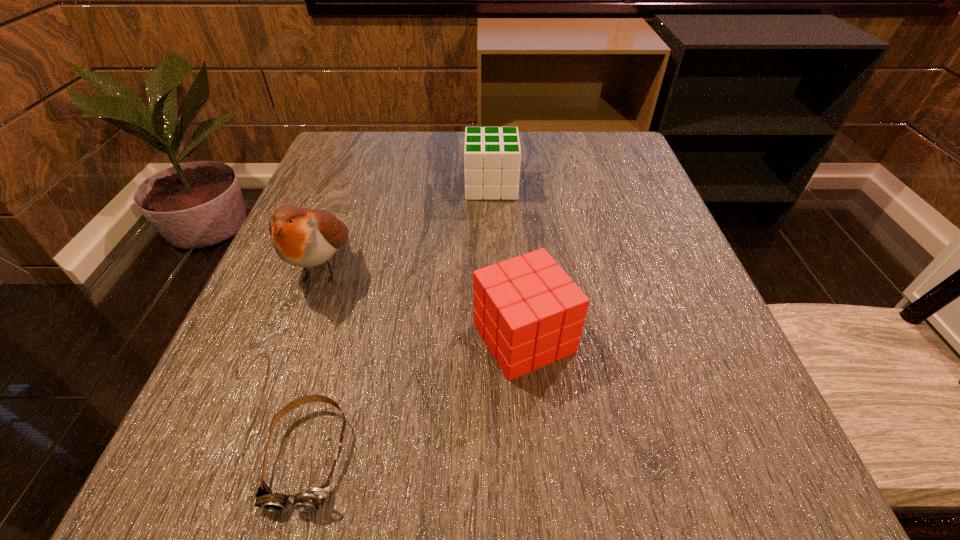
The width and height of the screenshot is (960, 540). What are the coordinates of `object that is the second closest one to the shortest object` in the screenshot? It's located at (303, 237).

The height and width of the screenshot is (540, 960). Find the location of `vacant space that satisfies the following two spatial constraints: 1. on the red face of the farthest object; 2. on the front-facing side of the shortest object`. vacant space that satisfies the following two spatial constraints: 1. on the red face of the farthest object; 2. on the front-facing side of the shortest object is located at coordinates (500, 455).

Image resolution: width=960 pixels, height=540 pixels. I want to click on free location that satisfies the following two spatial constraints: 1. on the red face of the farthest object; 2. on the front-facing side of the shortest object, so click(x=500, y=455).

Locate an element on the screen. free region that satisfies the following two spatial constraints: 1. on the red face of the nearer cube; 2. on the left side of the farther cube is located at coordinates (496, 338).

This screenshot has width=960, height=540. I want to click on vacant space that satisfies the following two spatial constraints: 1. on the red face of the farthest object; 2. on the front-facing side of the shortest object, so click(500, 455).

This screenshot has width=960, height=540. Identify the location of vacant region that satisfies the following two spatial constraints: 1. on the red face of the nearer cube; 2. on the right side of the farther cube. (496, 338).

Identify the location of vacant position in the image that satisfies the following two spatial constraints: 1. on the red face of the farther cube; 2. on the front-facing side of the goggles. (500, 455).

This screenshot has height=540, width=960. I want to click on vacant point that satisfies the following two spatial constraints: 1. at the face of the nearer cube; 2. on the left side of the bird, so click(298, 338).

I want to click on vacant region that satisfies the following two spatial constraints: 1. on the red face of the farther cube; 2. at the face of the bird, so click(x=493, y=267).

At what (x,y) coordinates should I click in order to perform the action: click on free space in the image that satisfies the following two spatial constraints: 1. on the red face of the farther cube; 2. on the left side of the nearer cube. Please return your answer as a coordinate pair (x, y). Looking at the image, I should click on (496, 338).